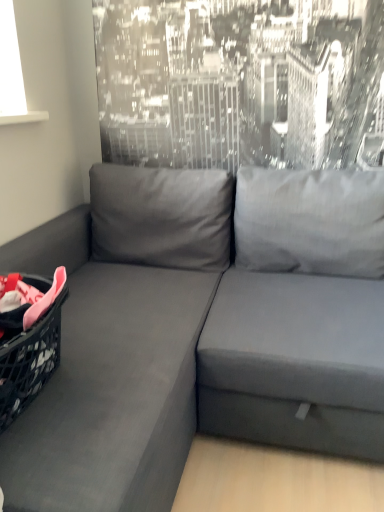
Question: Choose the correct answer: Is suede gray couch at left inside plastic black laundry basket at left or outside it?

Choices:
 (A) outside
 (B) inside

Answer: (A)

Question: Would you say suede gray couch at left is to the left or to the right of plastic black laundry basket at left in the picture?

Choices:
 (A) right
 (B) left

Answer: (A)

Question: Is suede gray couch at left in front of or behind plastic black laundry basket at left in the image?

Choices:
 (A) behind
 (B) front

Answer: (B)

Question: From the image's perspective, is plastic black laundry basket at left positioned above or below suede gray couch at left?

Choices:
 (A) below
 (B) above

Answer: (B)

Question: From their relative heights in the image, would you say plastic black laundry basket at left is taller or shorter than suede gray couch at left?

Choices:
 (A) short
 (B) tall

Answer: (A)

Question: In the image, is plastic black laundry basket at left positioned in front of or behind suede gray couch at left?

Choices:
 (A) front
 (B) behind

Answer: (B)

Question: Would you say plastic black laundry basket at left is to the left or to the right of suede gray couch at left in the picture?

Choices:
 (A) left
 (B) right

Answer: (A)